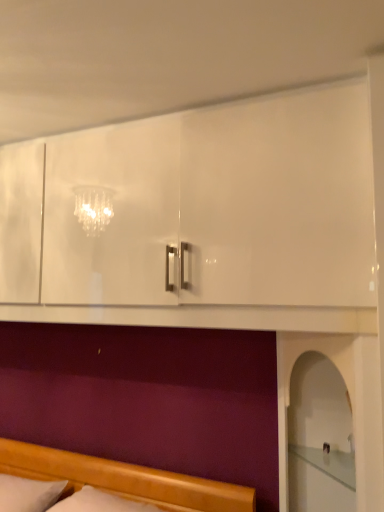
Question: From their relative heights in the image, would you say white glossy mantle at lower center is taller or shorter than white soft pillow at lower left?

Choices:
 (A) tall
 (B) short

Answer: (B)

Question: Looking at the image, does white glossy mantle at lower center seem bigger or smaller compared to white soft pillow at lower left?

Choices:
 (A) small
 (B) big

Answer: (A)

Question: Estimate the real-world distances between objects in this image. Which object is closer to the white glossy mantle at lower center?

Choices:
 (A) wooden bed at lower left
 (B) white soft pillow at lower left

Answer: (A)

Question: Which object is positioned farthest from the wooden bed at lower left?

Choices:
 (A) white soft pillow at lower left
 (B) white glossy mantle at lower center

Answer: (B)